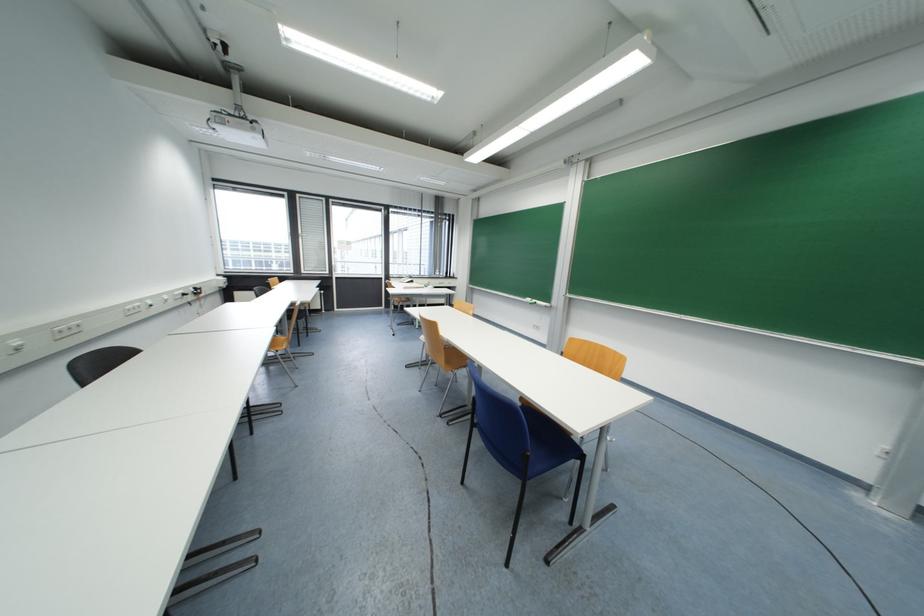
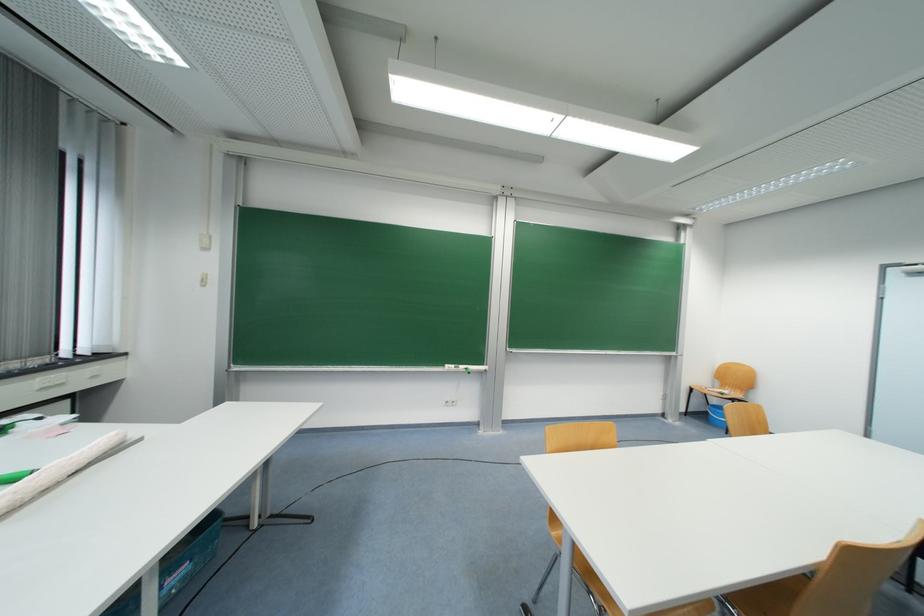
Locate, in the second image, the point that corresponds to point (539, 302) in the first image.

(467, 369)